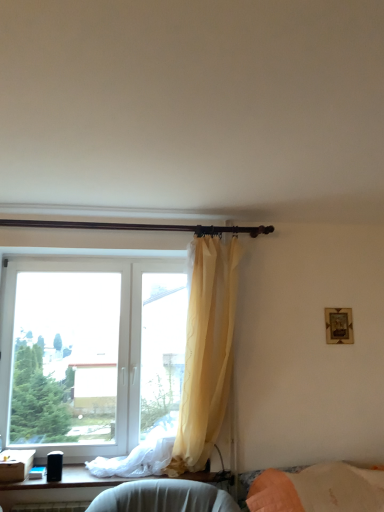
Question: Is translucent yellow curtain at upper center shorter than white plastic window at left?

Choices:
 (A) yes
 (B) no

Answer: (B)

Question: From a real-world perspective, is translucent yellow curtain at upper center physically below white plastic window at left?

Choices:
 (A) no
 (B) yes

Answer: (A)

Question: Does translucent yellow curtain at upper center have a greater height compared to white plastic window at left?

Choices:
 (A) yes
 (B) no

Answer: (A)

Question: Is translucent yellow curtain at upper center at the left side of white plastic window at left?

Choices:
 (A) no
 (B) yes

Answer: (A)

Question: Is translucent yellow curtain at upper center outside of white plastic window at left?

Choices:
 (A) yes
 (B) no

Answer: (A)

Question: Based on their positions, is dark brown wooden curtain rod at upper center located to the left or right of translucent yellow curtain at upper center?

Choices:
 (A) right
 (B) left

Answer: (B)

Question: From the image's perspective, relative to translucent yellow curtain at upper center, is dark brown wooden curtain rod at upper center above or below?

Choices:
 (A) below
 (B) above

Answer: (B)

Question: Based on their sizes in the image, would you say dark brown wooden curtain rod at upper center is bigger or smaller than translucent yellow curtain at upper center?

Choices:
 (A) big
 (B) small

Answer: (B)

Question: Does point [x=206, y=229] appear closer or farther from the camera than point [x=221, y=256]?

Choices:
 (A) closer
 (B) farther

Answer: (B)

Question: Is translucent yellow curtain at upper center situated inside dark brown wooden curtain rod at upper center or outside?

Choices:
 (A) inside
 (B) outside

Answer: (B)

Question: In terms of height, does translucent yellow curtain at upper center look taller or shorter compared to dark brown wooden curtain rod at upper center?

Choices:
 (A) tall
 (B) short

Answer: (A)

Question: From a real-world perspective, is translucent yellow curtain at upper center physically located above or below dark brown wooden curtain rod at upper center?

Choices:
 (A) above
 (B) below

Answer: (B)

Question: Is translucent yellow curtain at upper center bigger or smaller than dark brown wooden curtain rod at upper center?

Choices:
 (A) small
 (B) big

Answer: (B)

Question: From their relative heights in the image, would you say white plastic window at left is taller or shorter than black plastic speaker at lower left?

Choices:
 (A) short
 (B) tall

Answer: (B)

Question: In terms of width, does white plastic window at left look wider or thinner when compared to black plastic speaker at lower left?

Choices:
 (A) wide
 (B) thin

Answer: (B)